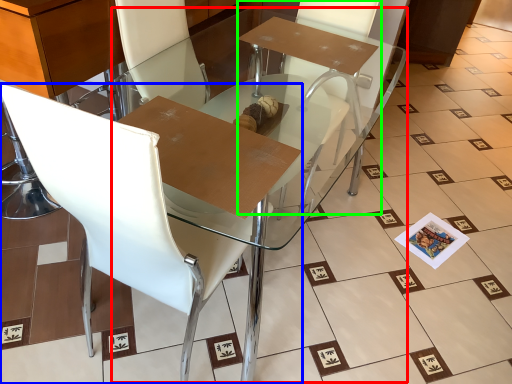
Question: Which object is positioned farthest from round table (highlighted by a red box)? Select from chair (highlighted by a blue box) and armchair (highlighted by a green box).

Choices:
 (A) chair
 (B) armchair

Answer: (A)